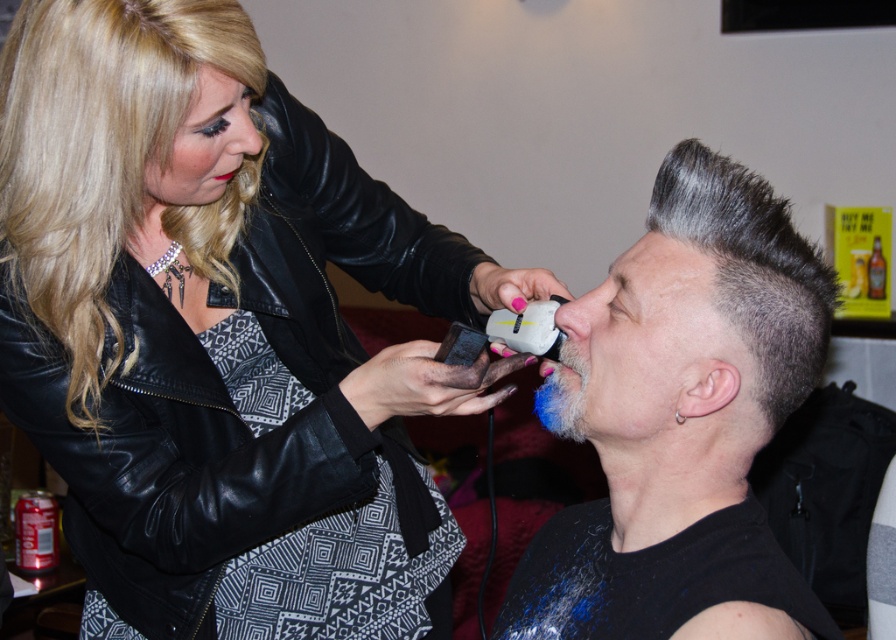
Does gray matte hair at upper right appear on the right side of pink matte lips at center?

Yes, gray matte hair at upper right is to the right of pink matte lips at center.

What do you see at coordinates (751, 266) in the screenshot? This screenshot has width=896, height=640. I see `gray matte hair at upper right` at bounding box center [751, 266].

Where is `gray matte hair at upper right`? This screenshot has width=896, height=640. gray matte hair at upper right is located at coordinates (751, 266).

I want to click on gray matte hair at upper right, so click(x=751, y=266).

Is black leather jacket at upper left closer to the viewer compared to shiny black leather jacket at upper left?

No, black leather jacket at upper left is behind shiny black leather jacket at upper left.

You are a GUI agent. You are given a task and a screenshot of the screen. Output one action in this format:
    pyautogui.click(x=<x>, y=<y>)
    Task: Click on the black leather jacket at upper left
    The width and height of the screenshot is (896, 640).
    Given the screenshot: What is the action you would take?
    pyautogui.click(x=212, y=310)

Between black leather jacket at upper left and shiny silver hair at center, which one is positioned lower?

Positioned lower is shiny silver hair at center.

Between black leather jacket at upper left and shiny silver hair at center, which one has less height?

Standing shorter between the two is shiny silver hair at center.

Where is `black leather jacket at upper left`? The width and height of the screenshot is (896, 640). black leather jacket at upper left is located at coordinates (212, 310).

Where is `black leather jacket at upper left`? The width and height of the screenshot is (896, 640). black leather jacket at upper left is located at coordinates (212, 310).